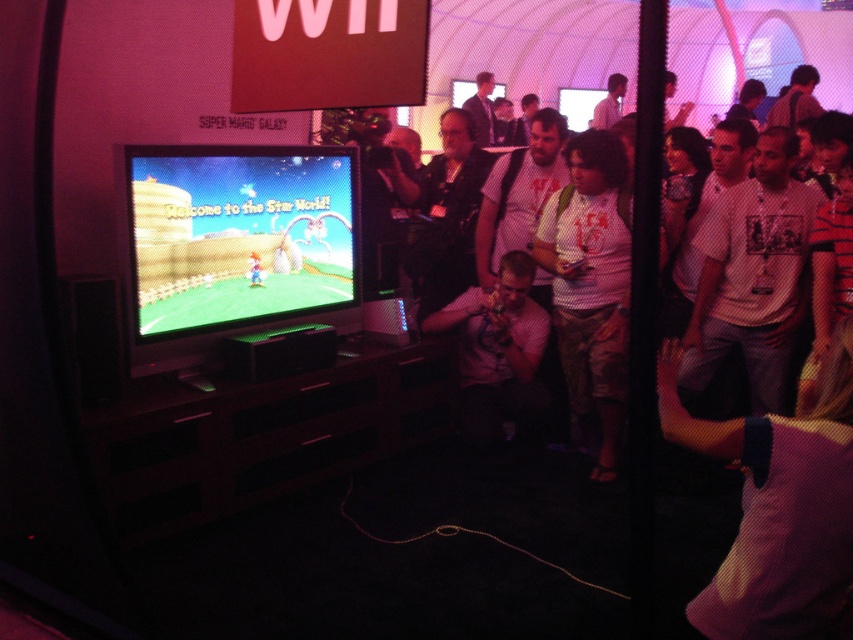
Question: In this image, where is purple mesh shirt at center located relative to white dotted shirt at center?

Choices:
 (A) right
 (B) left

Answer: (A)

Question: Estimate the real-world distances between objects in this image. Which object is closer to the white printed t-shirt at center?

Choices:
 (A) white dotted shirt at center
 (B) purple mesh shirt at center
 (C) white checkered shirt at center

Answer: (A)

Question: Where is white t-shirt at center located in relation to white checkered shirt at center in the image?

Choices:
 (A) right
 (B) left

Answer: (A)

Question: Does purple mesh shirt at center have a lesser width compared to white checkered shirt at center?

Choices:
 (A) yes
 (B) no

Answer: (A)

Question: Which of the following is the farthest from the observer?

Choices:
 (A) white checkered shirt at center
 (B) purple mesh shirt at center

Answer: (A)

Question: Which of the following is the farthest from the observer?

Choices:
 (A) white dotted shirt at center
 (B) white printed t-shirt at center

Answer: (A)